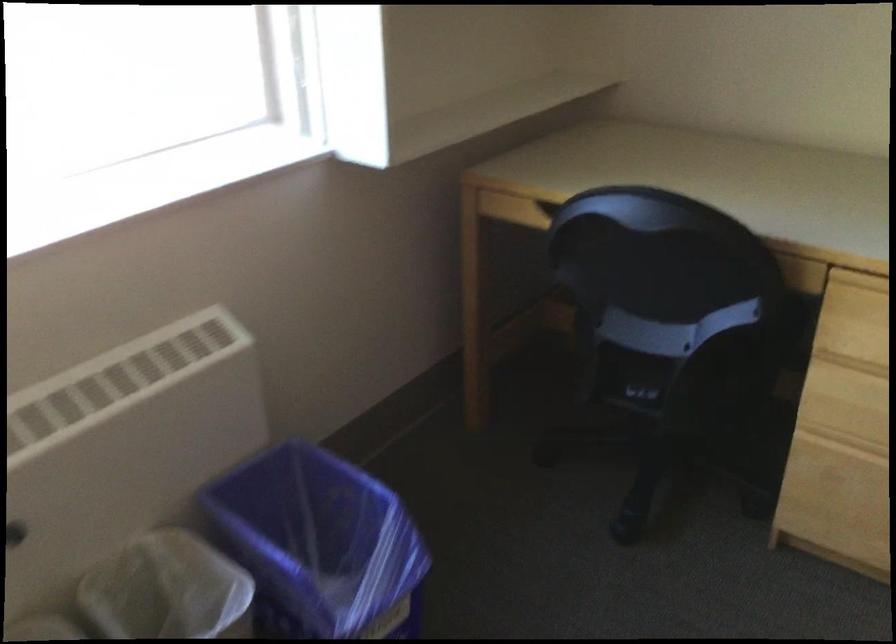
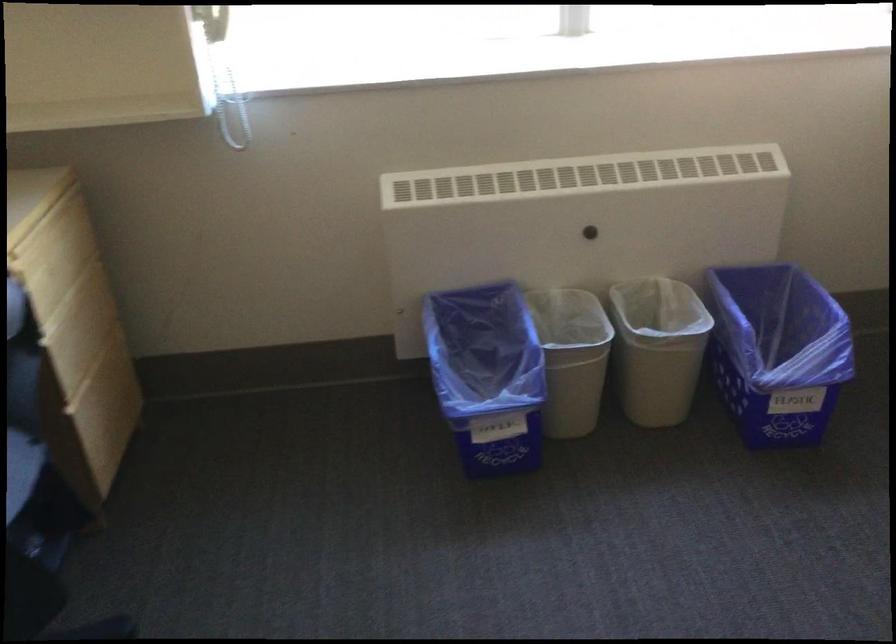
Where in the second image is the point corresponding to the point at 321,550 from the first image?

(777, 352)